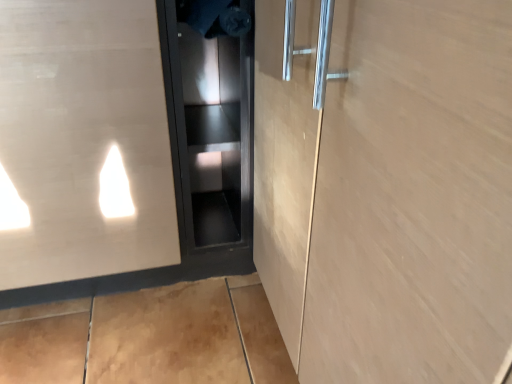
Question: Is satin silver elevator door at left, the second elevator door positioned from the right, situated inside black matte cabinet at center, placed as the 2th elevator door when sorted from left to right, or outside?

Choices:
 (A) inside
 (B) outside

Answer: (B)

Question: Based on their positions, is satin silver elevator door at left, the 1th elevator door when ordered from left to right, located to the left or right of black matte cabinet at center, the first elevator door in the right-to-left sequence?

Choices:
 (A) right
 (B) left

Answer: (B)

Question: Considering the positions of point (122, 256) and point (200, 205), is point (122, 256) closer or farther from the camera than point (200, 205)?

Choices:
 (A) closer
 (B) farther

Answer: (A)

Question: Visually, is black matte cabinet at center, the first elevator door in the right-to-left sequence, positioned to the left or to the right of satin silver elevator door at left, the 1th elevator door when ordered from left to right?

Choices:
 (A) left
 (B) right

Answer: (B)

Question: Is black matte cabinet at center, placed as the 2th elevator door when sorted from left to right, taller or shorter than satin silver elevator door at left, the second elevator door positioned from the right?

Choices:
 (A) short
 (B) tall

Answer: (A)

Question: Considering the positions of point pyautogui.click(x=168, y=125) and point pyautogui.click(x=77, y=142), is point pyautogui.click(x=168, y=125) closer or farther from the camera than point pyautogui.click(x=77, y=142)?

Choices:
 (A) farther
 (B) closer

Answer: (A)

Question: Considering the positions of black matte cabinet at center, placed as the 2th elevator door when sorted from left to right, and satin silver elevator door at left, the second elevator door positioned from the right, in the image, is black matte cabinet at center, placed as the 2th elevator door when sorted from left to right, bigger or smaller than satin silver elevator door at left, the second elevator door positioned from the right,?

Choices:
 (A) big
 (B) small

Answer: (B)